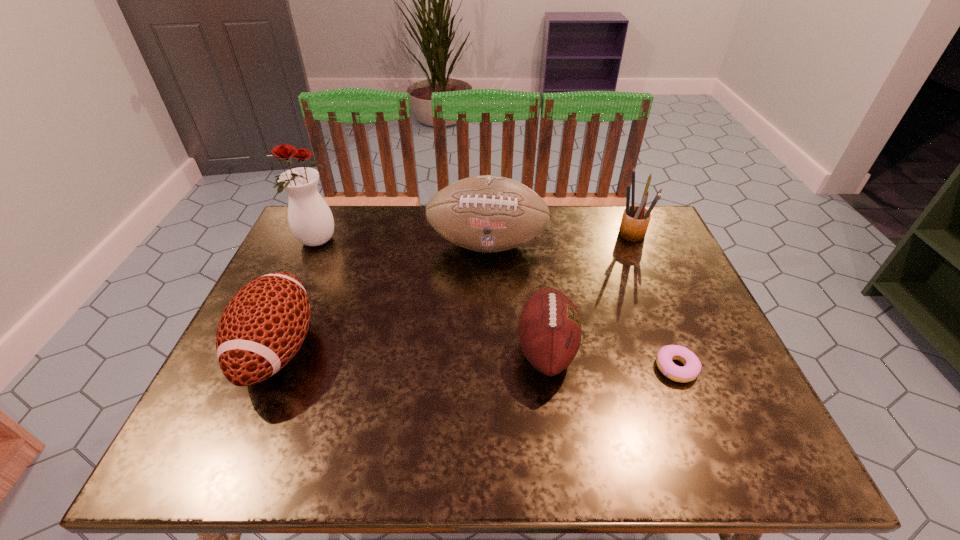
You are a GUI agent. You are given a task and a screenshot of the screen. Output one action in this format:
    pyautogui.click(x=<x>, y=<y>)
    Task: Click on the vase
    The height and width of the screenshot is (540, 960).
    Given the screenshot: What is the action you would take?
    pyautogui.click(x=310, y=219)

Where is `the farthest football (American)`? Image resolution: width=960 pixels, height=540 pixels. the farthest football (American) is located at coordinates (488, 213).

At what (x,y) coordinates should I click in order to perform the action: click on pencil box. Please return your answer as a coordinate pair (x, y). This screenshot has width=960, height=540. Looking at the image, I should click on (635, 220).

Locate an element on the screen. the leftmost football (American) is located at coordinates (263, 326).

Image resolution: width=960 pixels, height=540 pixels. I want to click on the shortest football (American), so click(x=549, y=327).

Where is `the shortest object`? the shortest object is located at coordinates click(x=692, y=366).

At what (x,y) coordinates should I click in order to perform the action: click on vacant region located on the right of the tallest object. Please return your answer as a coordinate pair (x, y). This screenshot has height=540, width=960. Looking at the image, I should click on (372, 242).

Where is `vacant area situated 0.400m on the laces of the farthest football (American)`? The image size is (960, 540). vacant area situated 0.400m on the laces of the farthest football (American) is located at coordinates (490, 391).

Image resolution: width=960 pixels, height=540 pixels. What are the coordinates of `vacant space situated on the left of the pencil box` in the screenshot? It's located at (589, 233).

Locate an element on the screen. This screenshot has width=960, height=540. free space located on the back of the second tallest football (American) is located at coordinates (x=319, y=253).